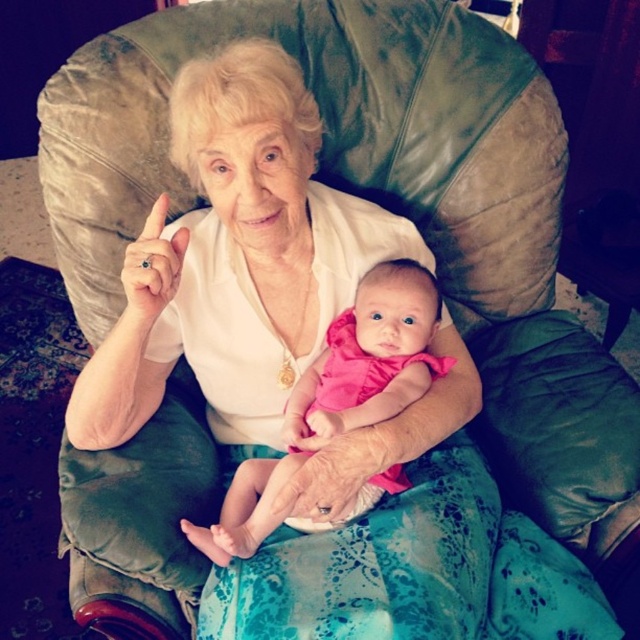
Question: Is pink fabric baby at center smaller than gold ring at upper center?

Choices:
 (A) yes
 (B) no

Answer: (B)

Question: Can you confirm if pink fabric baby at center is wider than gold ring at upper center?

Choices:
 (A) yes
 (B) no

Answer: (A)

Question: Which object is closer to the camera taking this photo?

Choices:
 (A) gold ring at upper center
 (B) pink fabric baby at center

Answer: (A)

Question: Is pink fabric baby at center positioned in front of gold ring at upper center?

Choices:
 (A) no
 (B) yes

Answer: (A)